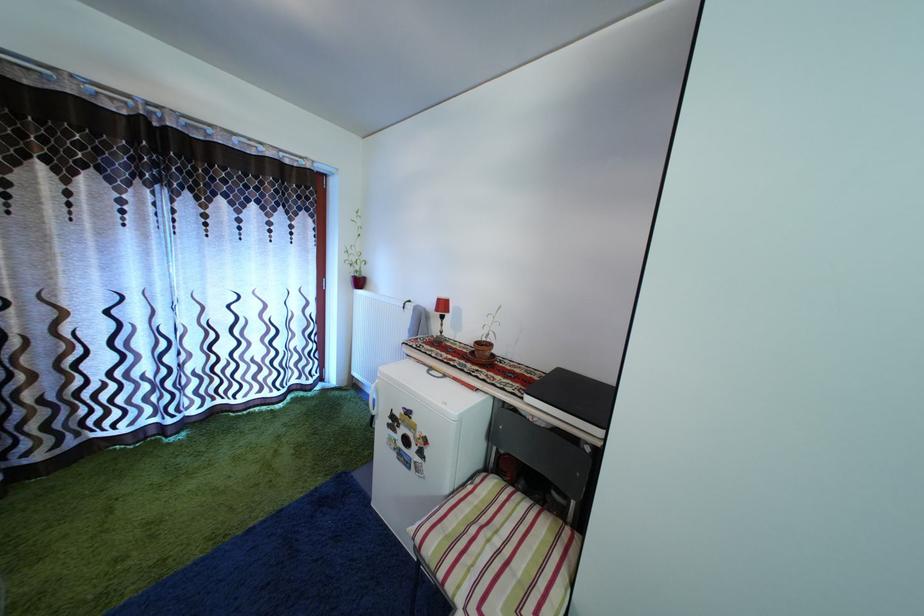
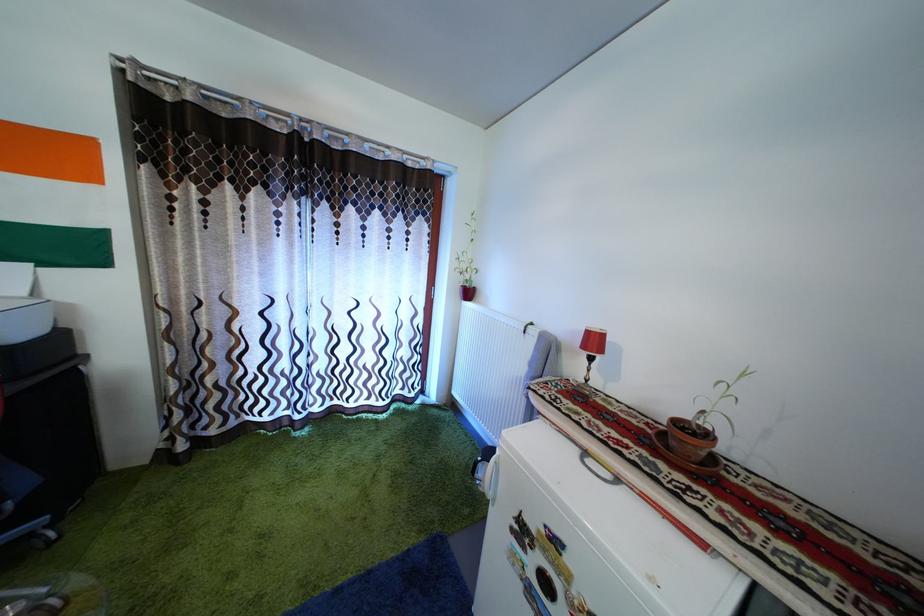
The point at (499, 353) is marked in the first image. Where is the corresponding point in the second image?

(715, 442)